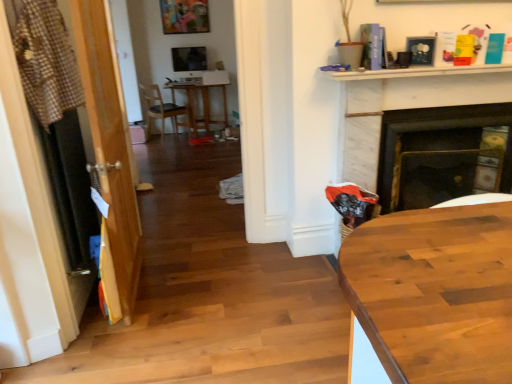
Question: Considering the relative sizes of black marble fireplace at center-right and matte wood chair at center in the image provided, is black marble fireplace at center-right bigger than matte wood chair at center?

Choices:
 (A) no
 (B) yes

Answer: (A)

Question: Considering the relative positions of black marble fireplace at center-right and matte wood chair at center in the image provided, is black marble fireplace at center-right to the right of matte wood chair at center from the viewer's perspective?

Choices:
 (A) no
 (B) yes

Answer: (B)

Question: Is black marble fireplace at center-right outside of matte wood chair at center?

Choices:
 (A) yes
 (B) no

Answer: (A)

Question: From the image's perspective, is black marble fireplace at center-right over matte wood chair at center?

Choices:
 (A) yes
 (B) no

Answer: (B)

Question: Could you tell me if black marble fireplace at center-right is facing matte wood chair at center?

Choices:
 (A) no
 (B) yes

Answer: (A)

Question: Does black marble fireplace at center-right have a lesser width compared to matte wood chair at center?

Choices:
 (A) no
 (B) yes

Answer: (B)

Question: Could checkered fabric laundry at left be considered to be inside matte black picture frame at upper right?

Choices:
 (A) no
 (B) yes

Answer: (A)

Question: Considering the relative sizes of matte black picture frame at upper right and checkered fabric laundry at left in the image provided, is matte black picture frame at upper right smaller than checkered fabric laundry at left?

Choices:
 (A) no
 (B) yes

Answer: (B)

Question: Is matte black picture frame at upper right to the right of checkered fabric laundry at left from the viewer's perspective?

Choices:
 (A) no
 (B) yes

Answer: (B)

Question: From the image's perspective, is matte black picture frame at upper right located above checkered fabric laundry at left?

Choices:
 (A) yes
 (B) no

Answer: (A)

Question: Is matte black picture frame at upper right turned away from checkered fabric laundry at left?

Choices:
 (A) no
 (B) yes

Answer: (A)

Question: Does matte black picture frame at upper right turn towards checkered fabric laundry at left?

Choices:
 (A) no
 (B) yes

Answer: (A)

Question: Does matte black picture frame at upper right turn towards matte wood chair at center?

Choices:
 (A) yes
 (B) no

Answer: (B)